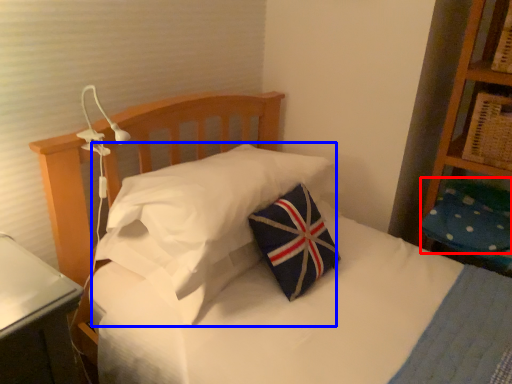
Question: Which of the following is the closest to the observer, pillow (highlighted by a red box) or pillow (highlighted by a blue box)?

Choices:
 (A) pillow
 (B) pillow

Answer: (B)